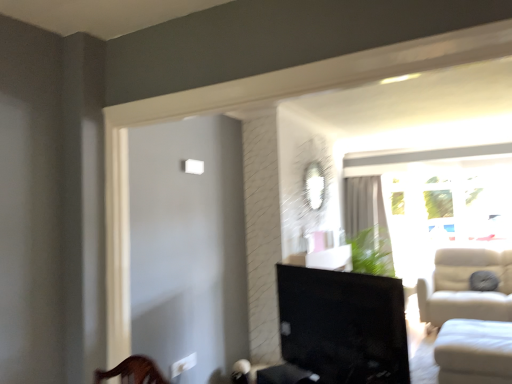
Question: From the image's perspective, is transparent glass window at right on top of matte black tv at center?

Choices:
 (A) no
 (B) yes

Answer: (B)

Question: Can you confirm if transparent glass window at right is thinner than matte black tv at center?

Choices:
 (A) yes
 (B) no

Answer: (B)

Question: Is transparent glass window at right positioned with its back to matte black tv at center?

Choices:
 (A) yes
 (B) no

Answer: (B)

Question: Does transparent glass window at right have a larger size compared to matte black tv at center?

Choices:
 (A) no
 (B) yes

Answer: (B)

Question: From a real-world perspective, does transparent glass window at right sit lower than matte black tv at center?

Choices:
 (A) no
 (B) yes

Answer: (A)

Question: Based on their sizes in the image, would you say white fabric studio couch at lower right is bigger or smaller than transparent glass window at right?

Choices:
 (A) big
 (B) small

Answer: (B)

Question: Looking at their shapes, would you say white fabric studio couch at lower right is wider or thinner than transparent glass window at right?

Choices:
 (A) wide
 (B) thin

Answer: (A)

Question: From the image's perspective, is white fabric studio couch at lower right positioned above or below transparent glass window at right?

Choices:
 (A) above
 (B) below

Answer: (B)

Question: Is point (453, 334) closer or farther from the camera than point (412, 248)?

Choices:
 (A) closer
 (B) farther

Answer: (A)

Question: Based on their sizes in the image, would you say white fabric studio couch at lower right is bigger or smaller than white sheer curtain at upper right?

Choices:
 (A) big
 (B) small

Answer: (A)

Question: Is white fabric studio couch at lower right to the left or to the right of white sheer curtain at upper right in the image?

Choices:
 (A) left
 (B) right

Answer: (B)

Question: Is white fabric studio couch at lower right situated inside white sheer curtain at upper right or outside?

Choices:
 (A) inside
 (B) outside

Answer: (B)

Question: Considering their positions, is white fabric studio couch at lower right located in front of or behind white sheer curtain at upper right?

Choices:
 (A) front
 (B) behind

Answer: (A)

Question: In terms of size, does white sheer curtain at upper right appear bigger or smaller than white fabric studio couch at lower right?

Choices:
 (A) big
 (B) small

Answer: (B)

Question: In the image, is white sheer curtain at upper right on the left side or the right side of white fabric studio couch at lower right?

Choices:
 (A) right
 (B) left

Answer: (B)